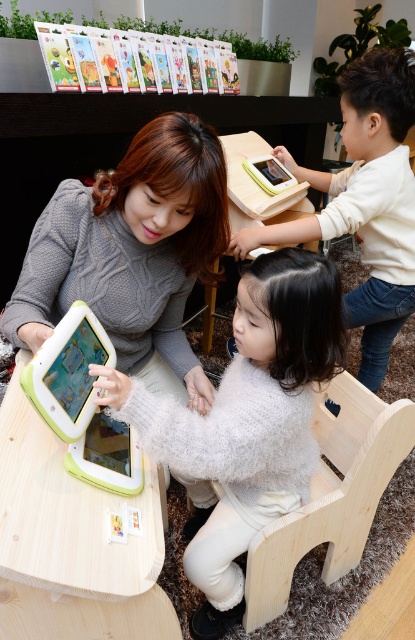
Looking at this image, you are a delivery robot with a package that needs to be placed between the white fluffy sweater at center and the green matte tablet at lower center. The package is 10 cm wide. Can you fit it there?

The white fluffy sweater at center might be wider than the green matte tablet at lower center, so the space between them could accommodate the 10 cm wide package. However, since the exact width difference isn not specified, it is uncertain. Please check the actual space before placing the package.

You are a delivery robot with a 12 inch wide package. You need to place it between the white fluffy sweater at center and the green matte tablet at lower center. Can you fit the package there?

The white fluffy sweater at center and green matte tablet at lower center are 10.51 inches apart from each other. Since the package is 12 inches wide, it cannot fit in the space between them.

You are trying to decide whether to place a large decorative pillow on the table. The white fluffy sweater at center and the natural wood chair at lower center are already on the table. Considering their sizes, will there be enough space for the pillow?

The white fluffy sweater at center is larger than the natural wood chair at lower center. Since the sweater takes up more space on the table, there might not be enough room left for the large decorative pillow unless some items are moved.